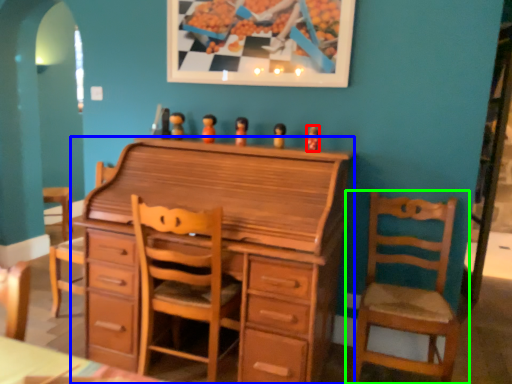
Question: Which object is the closest to the toy (highlighted by a red box)? Choose among these: chest of drawers (highlighted by a blue box) or chair (highlighted by a green box).

Choices:
 (A) chest of drawers
 (B) chair

Answer: (A)